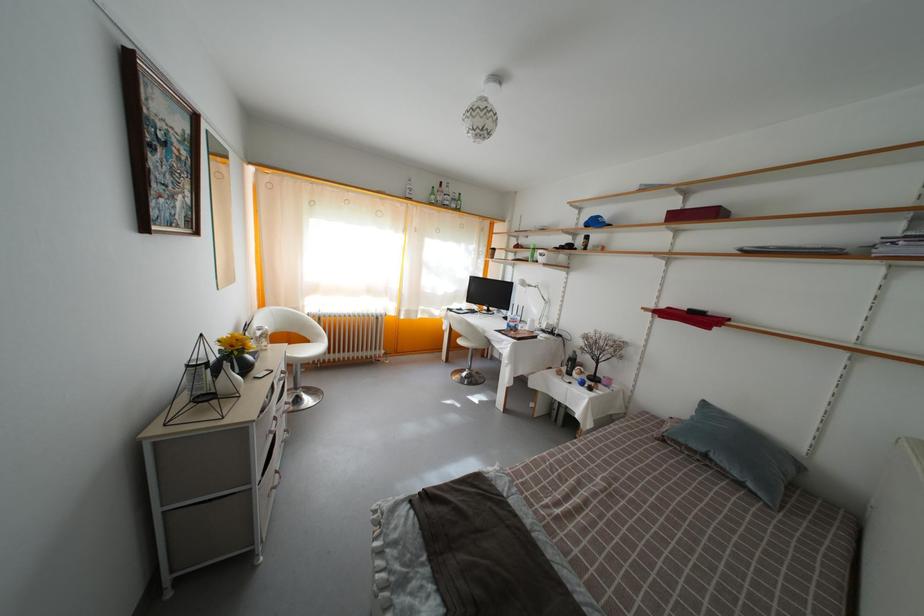
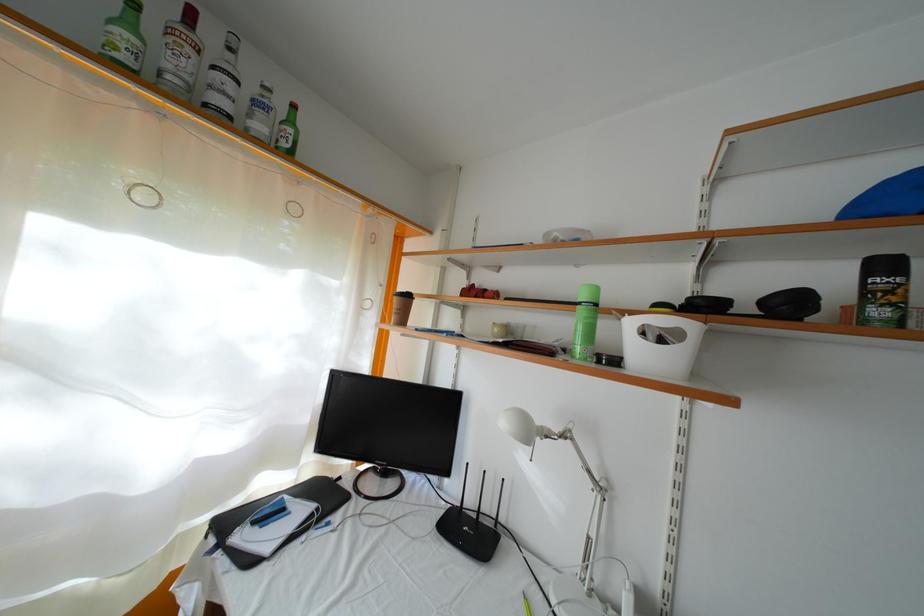
Where in the second image is the point corresponding to (x=459, y=212) from the first image?

(264, 134)